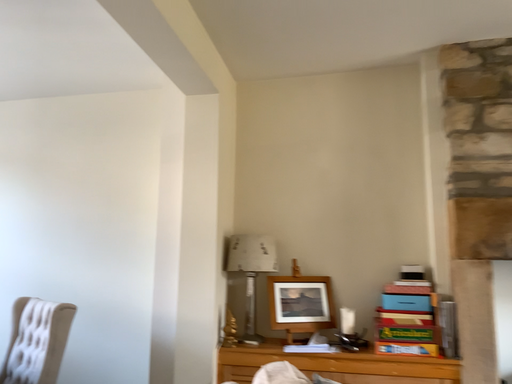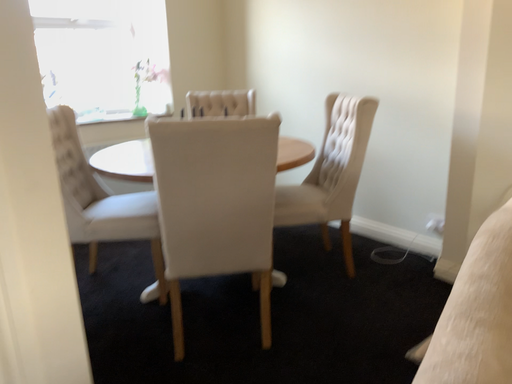
Question: Which way did the camera rotate in the video?

Choices:
 (A) rotated upward
 (B) rotated downward

Answer: (B)